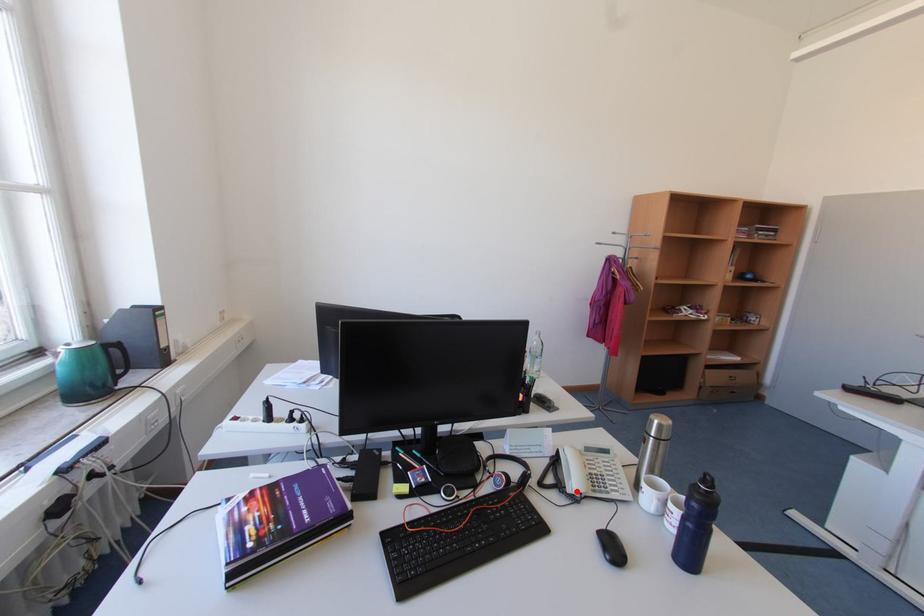
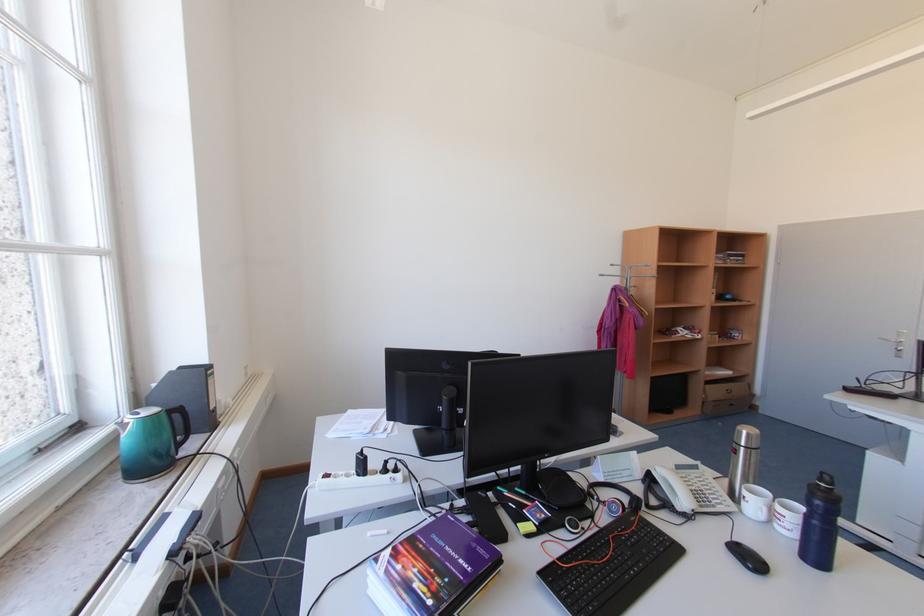
Where in the second image is the point corresponding to the highlighted location from the first image?

(687, 509)